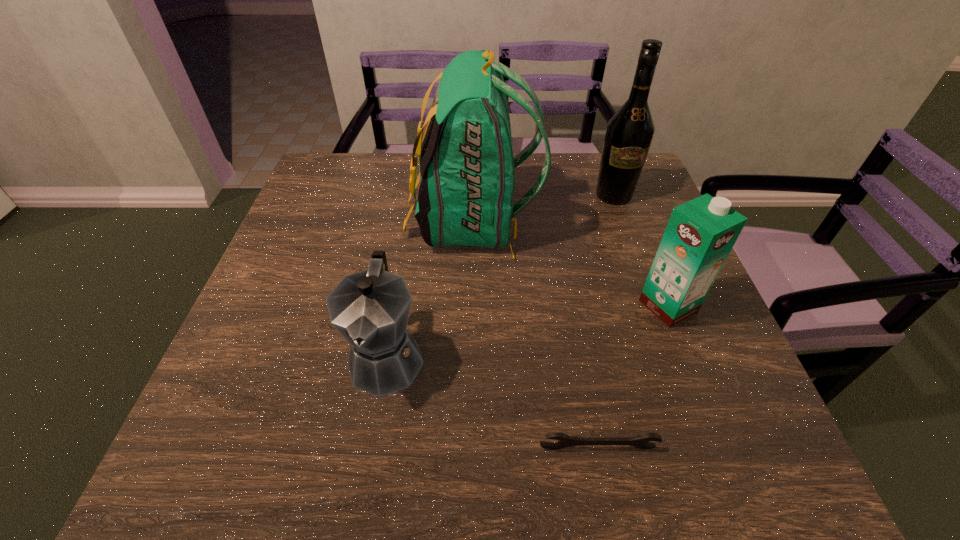
Where is `vacant point located between the carton and the wine bottle`? The width and height of the screenshot is (960, 540). vacant point located between the carton and the wine bottle is located at coordinates (641, 251).

I want to click on object that ranks as the closest to the carton, so click(x=465, y=198).

This screenshot has width=960, height=540. What are the coordinates of `object that stands as the third closest to the fourth tallest object` in the screenshot? It's located at (700, 234).

Image resolution: width=960 pixels, height=540 pixels. Identify the location of blank area in the image that satisfies the following two spatial constraints: 1. on the label of the wine bottle; 2. on the back of the backpack. (623, 222).

At what (x,y) coordinates should I click in order to perform the action: click on free spot that satisfies the following two spatial constraints: 1. on the label of the carton; 2. on the left side of the wine bottle. Please return your answer as a coordinate pair (x, y). This screenshot has width=960, height=540. Looking at the image, I should click on (653, 306).

The height and width of the screenshot is (540, 960). Find the location of `free region that satisfies the following two spatial constraints: 1. on the back of the backpack; 2. at the spout of the second shortest object`. free region that satisfies the following two spatial constraints: 1. on the back of the backpack; 2. at the spout of the second shortest object is located at coordinates (469, 357).

Identify the location of free location that satisfies the following two spatial constraints: 1. on the label of the wine bottle; 2. on the right side of the carton. Image resolution: width=960 pixels, height=540 pixels. (653, 306).

Where is `free space in the image that satisfies the following two spatial constraints: 1. on the back of the backpack; 2. at the spout of the fourth tallest object`? The height and width of the screenshot is (540, 960). free space in the image that satisfies the following two spatial constraints: 1. on the back of the backpack; 2. at the spout of the fourth tallest object is located at coordinates (469, 357).

I want to click on vacant area that satisfies the following two spatial constraints: 1. on the back of the backpack; 2. at the spout of the fourth tallest object, so click(469, 357).